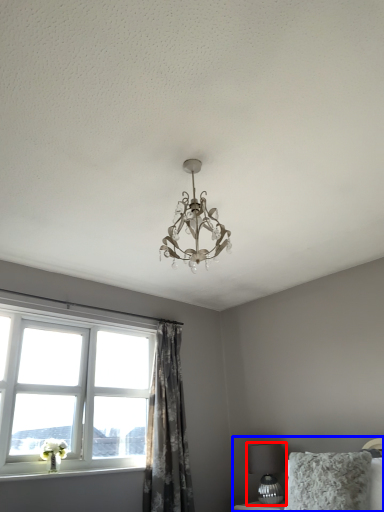
Question: Among these objects, which one is nearest to the camera, table lamp (highlighted by a red box) or bed (highlighted by a blue box)?

Choices:
 (A) table lamp
 (B) bed

Answer: (B)